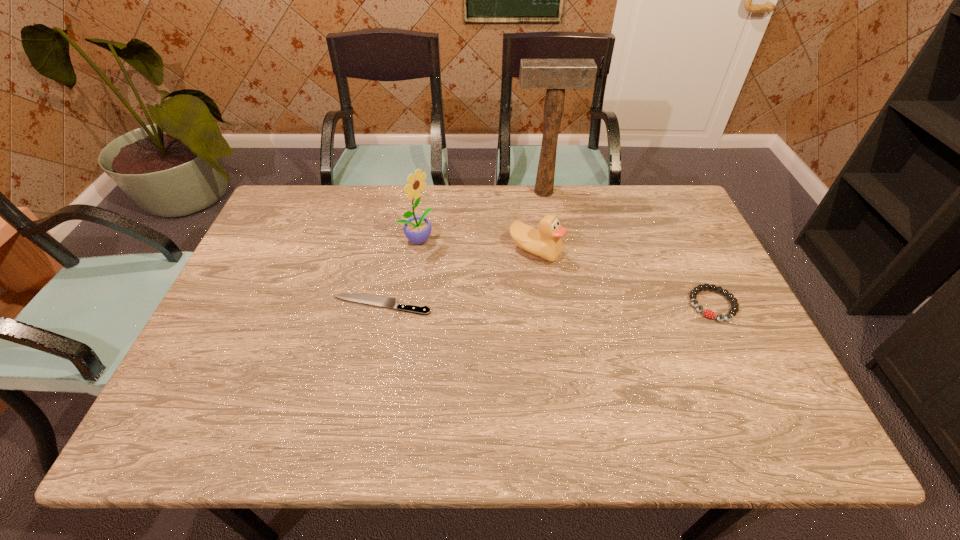
Locate an element on the screen. The width and height of the screenshot is (960, 540). empty space between the second tallest object and the duck is located at coordinates (476, 245).

The height and width of the screenshot is (540, 960). What are the coordinates of `vacant region between the second tallest object and the duck` in the screenshot? It's located at (476, 245).

Identify the location of unoccupied area between the fourth shortest object and the steak knife. (398, 272).

At what (x,y) coordinates should I click in order to perform the action: click on vacant point located between the steak knife and the bracelet. Please return your answer as a coordinate pair (x, y). This screenshot has width=960, height=540. Looking at the image, I should click on (546, 305).

Where is `vacant point located between the rightmost object and the second tallest object`? This screenshot has width=960, height=540. vacant point located between the rightmost object and the second tallest object is located at coordinates [x=564, y=272].

Locate an element on the screen. The height and width of the screenshot is (540, 960). empty space that is in between the fourth shortest object and the rightmost object is located at coordinates (564, 272).

Find the location of `the fourth closest object to the rightmost object`. the fourth closest object to the rightmost object is located at coordinates (417, 229).

I want to click on the second closest object to the shortest object, so click(x=546, y=242).

Find the location of a particular element. vacant space that satisfies the following two spatial constraints: 1. on the back side of the third tallest object; 2. on the right side of the farthest object is located at coordinates 528,192.

The image size is (960, 540). Find the location of `vacant space that satisfies the following two spatial constraints: 1. on the back side of the shortest object; 2. on the right side of the bracelet`. vacant space that satisfies the following two spatial constraints: 1. on the back side of the shortest object; 2. on the right side of the bracelet is located at coordinates (381, 305).